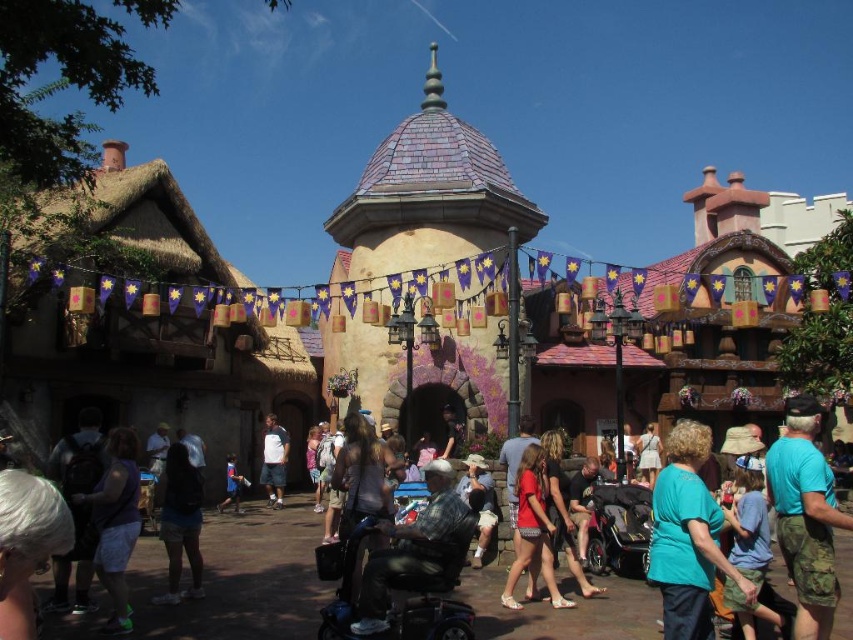
Question: Can you confirm if blue cotton shirt at lower right is positioned to the right of matte red shirt at center?

Choices:
 (A) yes
 (B) no

Answer: (A)

Question: Which point is closer to the camera?

Choices:
 (A) matte red shirt at center
 (B) matte red shorts at center
 (C) black plastic baby carriage at lower center
 (D) teal fabric shirt at center

Answer: (D)

Question: Which of the following is the farthest from the observer?

Choices:
 (A) (703, 538)
 (B) (431, 589)
 (C) (167, 484)

Answer: (C)

Question: Is dark blue fabric dress at lower left below matte red shorts at center?

Choices:
 (A) yes
 (B) no

Answer: (B)

Question: Which is nearer to the black plastic baby carriage at lower center?

Choices:
 (A) black denim shorts at lower left
 (B) teal fabric shirt at center
 (C) dark blue fabric dress at lower left
 (D) matte red shirt at center

Answer: (D)

Question: Where is dark blue fabric dress at lower left located in relation to matte red shorts at center in the image?

Choices:
 (A) above
 (B) below

Answer: (A)